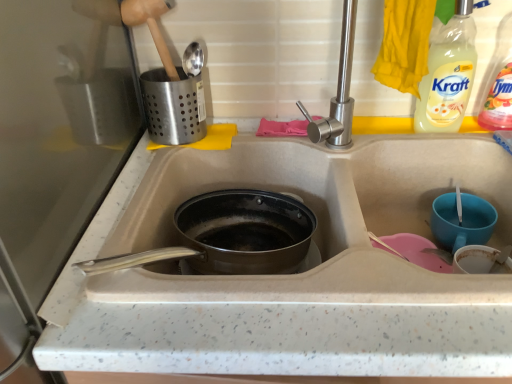
Question: Is clear plastic bottle at upper right, the 2th bottle positioned from the left, taller or shorter than blue glossy cup at right?

Choices:
 (A) tall
 (B) short

Answer: (A)

Question: Considering the positions of clear plastic bottle at upper right, the 2th bottle positioned from the left, and blue glossy cup at right in the image, is clear plastic bottle at upper right, the 2th bottle positioned from the left, wider or thinner than blue glossy cup at right?

Choices:
 (A) thin
 (B) wide

Answer: (A)

Question: Considering the real-world distances, which object is farthest from the matte gray sink at center?

Choices:
 (A) wooden shovel at upper left
 (B) blue glossy cup at right
 (C) clear plastic bottle at upper right, acting as the second bottle starting from the right
 (D) clear plastic bottle at upper right, the 2th bottle positioned from the left
 (E) anodized aluminum frying pan at center

Answer: (A)

Question: Considering the real-world distances, which object is closest to the anodized aluminum frying pan at center?

Choices:
 (A) clear plastic bottle at upper right, the 2th bottle positioned from the left
 (B) blue glossy cup at right
 (C) wooden shovel at upper left
 (D) matte gray sink at center
 (E) clear plastic bottle at upper right, acting as the second bottle starting from the right

Answer: (D)